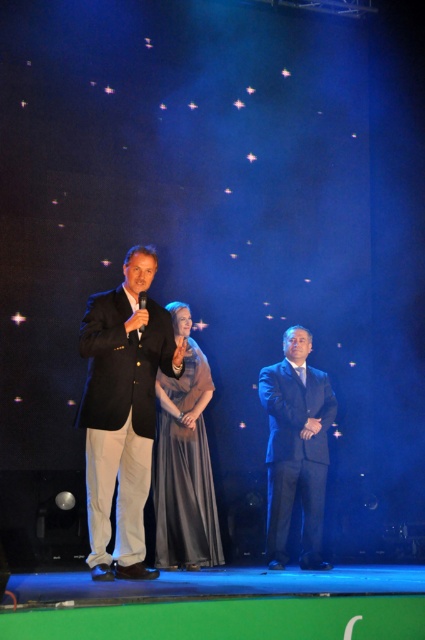
The height and width of the screenshot is (640, 425). What do you see at coordinates (184, 470) in the screenshot?
I see `satin silver dress at center` at bounding box center [184, 470].

Which is in front, point (189, 545) or point (306, 474)?

Point (189, 545) is in front.

Identify the location of satin silver dress at center. (184, 470).

Image resolution: width=425 pixels, height=640 pixels. What are the coordinates of `dark blue suit at center` in the screenshot? It's located at (295, 448).

Is dark blue suit at center thinner than shiny black suit at center?

Indeed, dark blue suit at center has a lesser width compared to shiny black suit at center.

Measure the distance between point (291, 362) and camera.

They are 6.51 meters apart.

This screenshot has height=640, width=425. What are the coordinates of `dark blue suit at center` in the screenshot? It's located at (295, 448).

Can you confirm if matte black suit at center is shorter than dark blue suit at center?

In fact, matte black suit at center may be taller than dark blue suit at center.

Is point (127, 522) positioned in front of point (317, 401)?

Yes.

Image resolution: width=425 pixels, height=640 pixels. What are the coordinates of `matte black suit at center` in the screenshot? It's located at (122, 412).